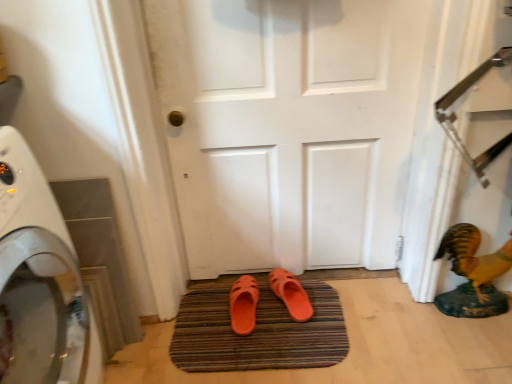
Locate an element on the screen. The width and height of the screenshot is (512, 384). spots to the right of orange rubber bath mat at center is located at coordinates (388, 328).